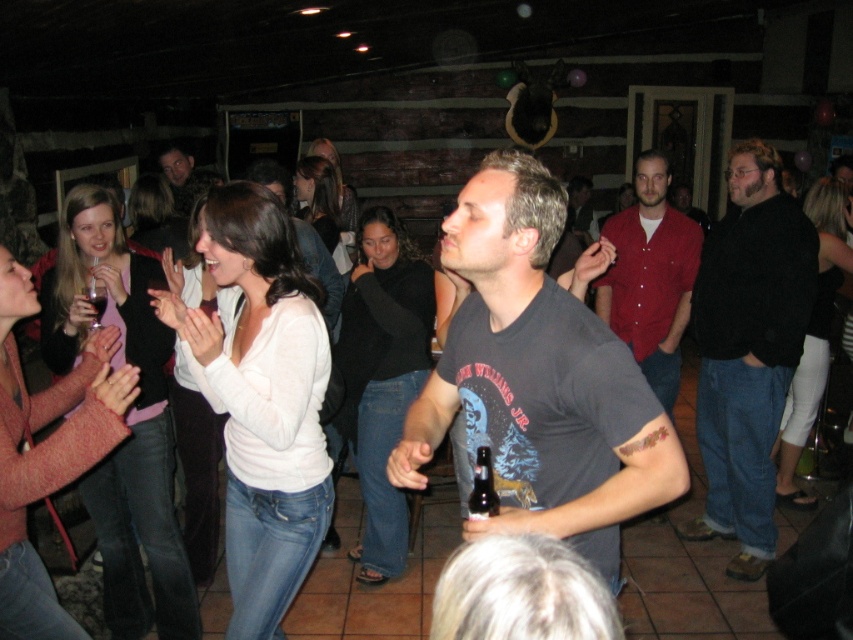
Is white matte sweater at center shorter than matte white sweater at left?

Correct, white matte sweater at center is not as tall as matte white sweater at left.

Between white matte sweater at center and matte white sweater at left, which one has more height?

Standing taller between the two is matte white sweater at left.

Measure the distance between white matte sweater at center and camera.

white matte sweater at center and camera are 6.96 feet apart.

Find the location of a particular element. This screenshot has width=853, height=640. white matte sweater at center is located at coordinates (262, 401).

Who is lower down, knitted pink sweater at lower left or white leggings at right?

Positioned lower is knitted pink sweater at lower left.

Is knitted pink sweater at lower left bigger than white leggings at right?

Incorrect, knitted pink sweater at lower left is not larger than white leggings at right.

Locate an element on the screen. knitted pink sweater at lower left is located at coordinates (45, 452).

Locate an element on the screen. The image size is (853, 640). knitted pink sweater at lower left is located at coordinates (45, 452).

Which is more to the right, white matte sweater at center or red button-down shirt at center?

From the viewer's perspective, red button-down shirt at center appears more on the right side.

Where is `white matte sweater at center`? white matte sweater at center is located at coordinates (262, 401).